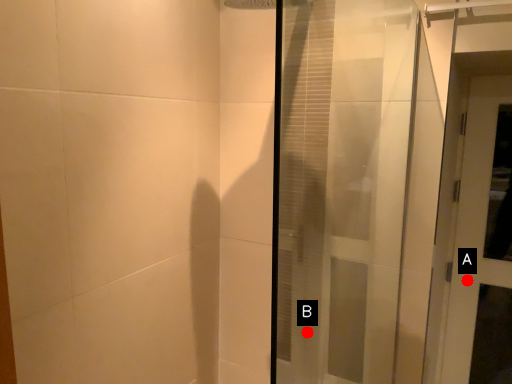
Question: Two points are circled on the image, labeled by A and B beside each circle. Which point is closer to the camera?

Choices:
 (A) A is closer
 (B) B is closer

Answer: (B)